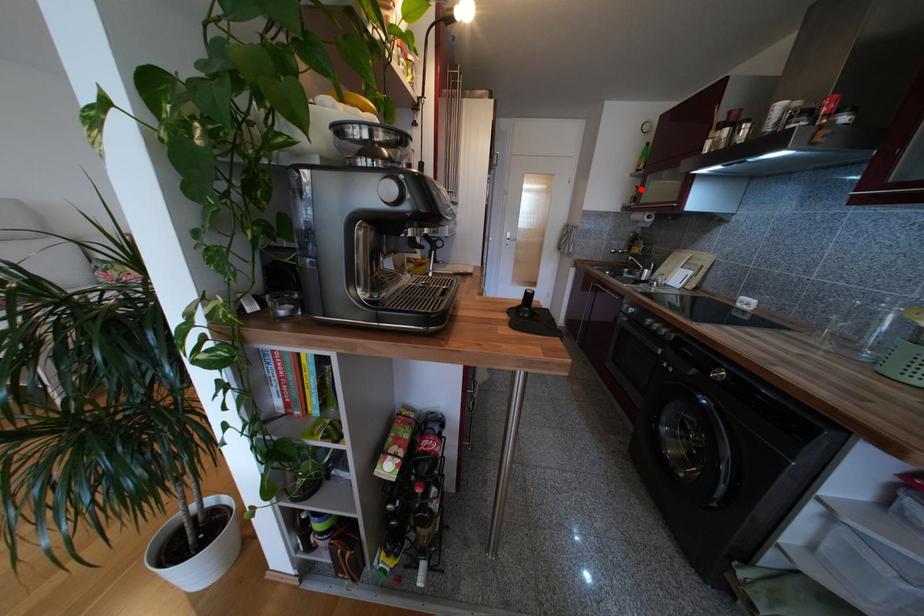
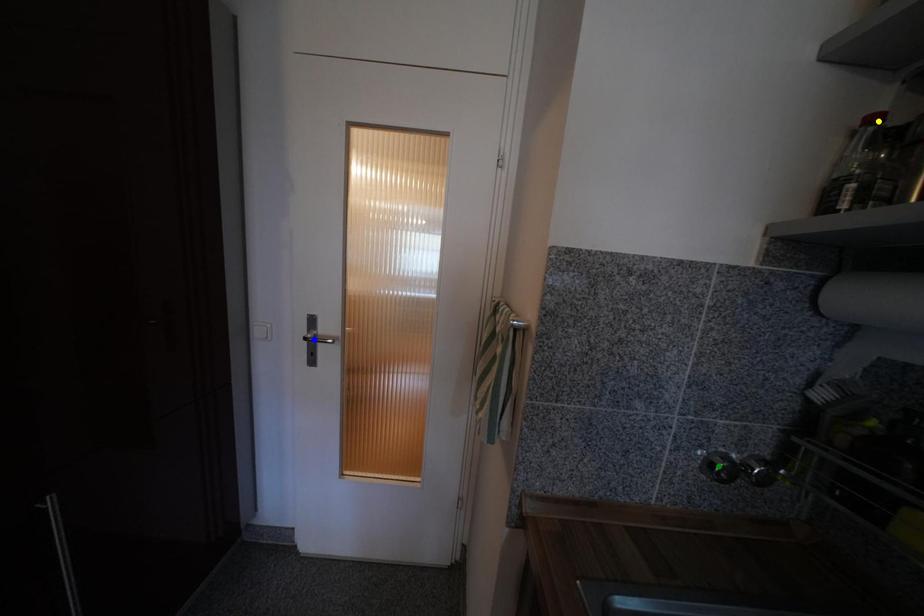
Question: I am providing you with two images of the same scene from different viewpoints. A red point is marked on the first image. You are given multiple points on the second image. Which mark in image 2 goes with the point in image 1?

Choices:
 (A) yellow point
 (B) blue point
 (C) green point

Answer: (A)